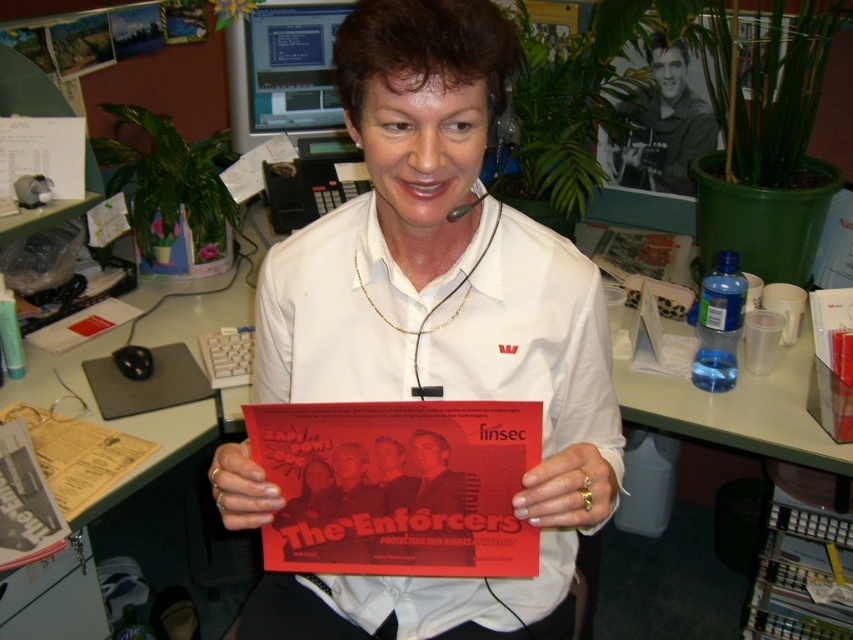
Question: Does gold ring at center appear on the right side of matte paper brochure at center?

Choices:
 (A) yes
 (B) no

Answer: (A)

Question: Which point is farther to the camera?

Choices:
 (A) matte paper flyer at center
 (B) matte paper brochure at center
 (C) green plastic table at center

Answer: (C)

Question: Which object appears farthest from the camera in this image?

Choices:
 (A) matte paper booklet at center
 (B) red paper brochure at center
 (C) green plastic table at center
 (D) gold ring at center

Answer: (B)

Question: Does green plastic table at center appear on the right side of red paper brochure at center?

Choices:
 (A) yes
 (B) no

Answer: (B)

Question: Can you confirm if green plastic table at center is positioned above red paper brochure at center?

Choices:
 (A) yes
 (B) no

Answer: (A)

Question: Which point is farther to the camera?

Choices:
 (A) matte paper flyer at center
 (B) matte paper brochure at center

Answer: (B)